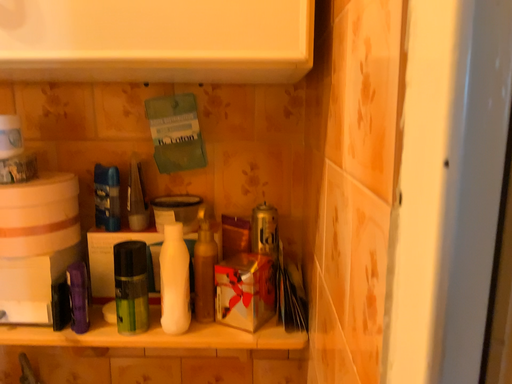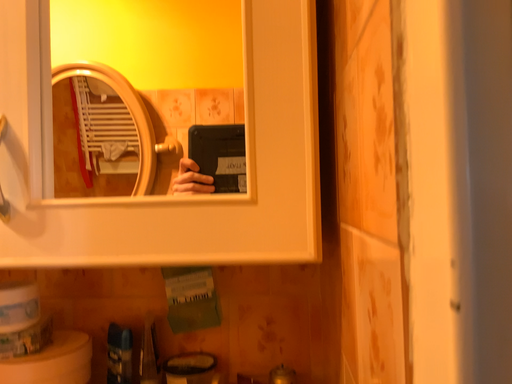
Question: Which way did the camera rotate in the video?

Choices:
 (A) rotated downward
 (B) rotated upward

Answer: (B)